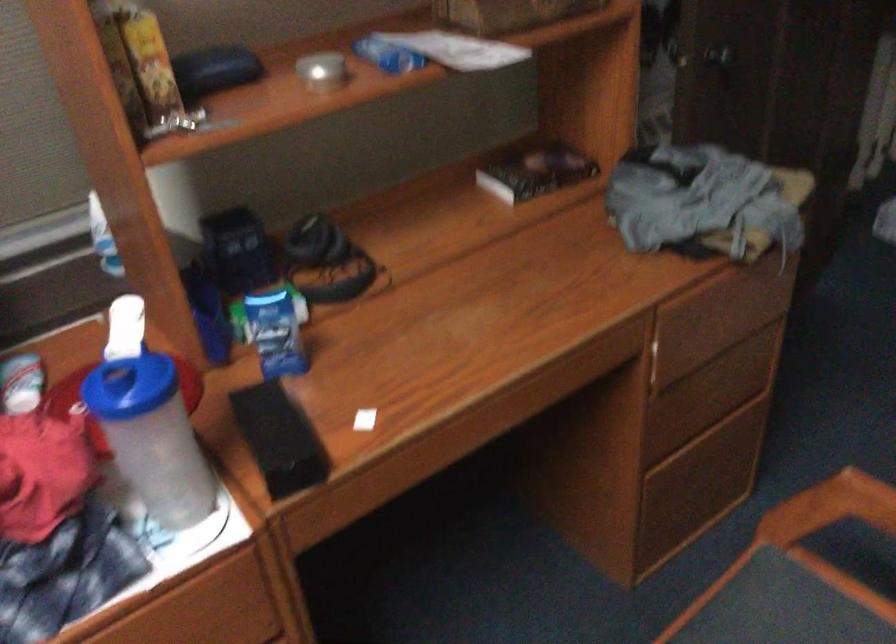
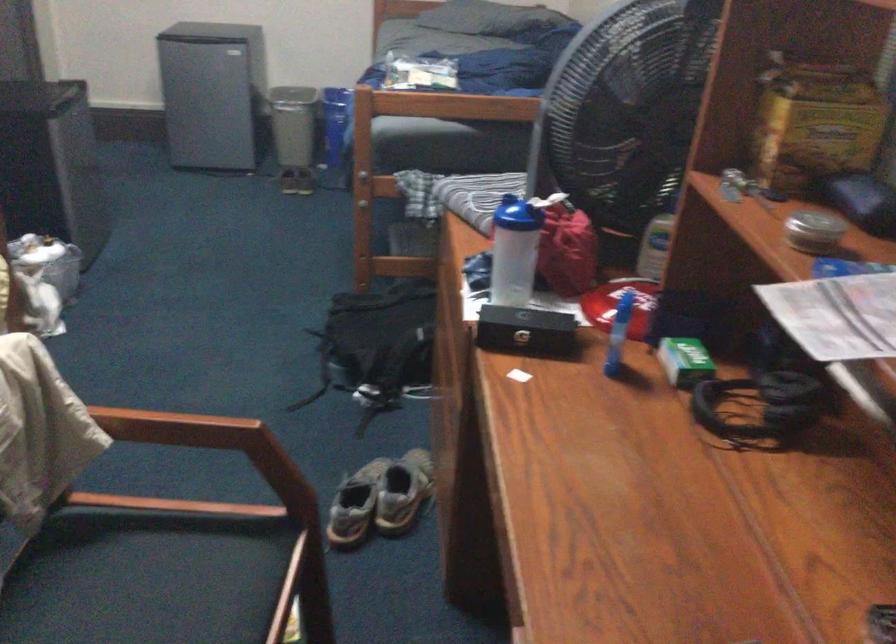
Locate, in the second image, the point that corresponds to point (126, 382) in the first image.

(510, 214)